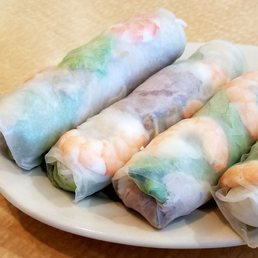
Find the location of `plate`. plate is located at coordinates (86, 207).